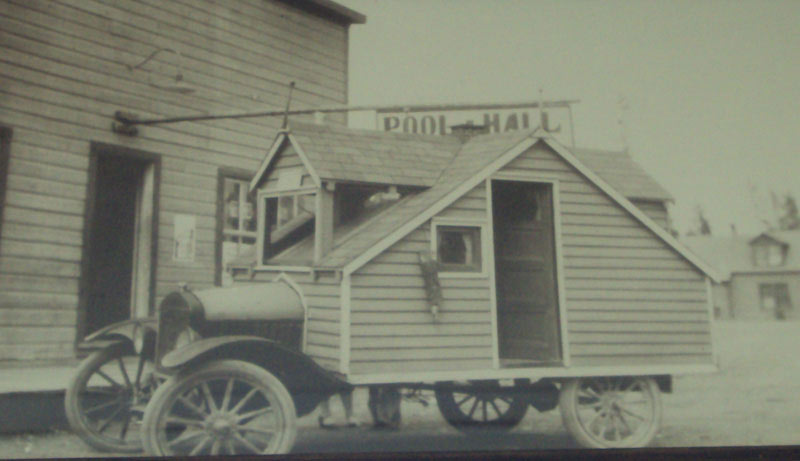
Identify the location of pool hall. (406, 120), (516, 119).